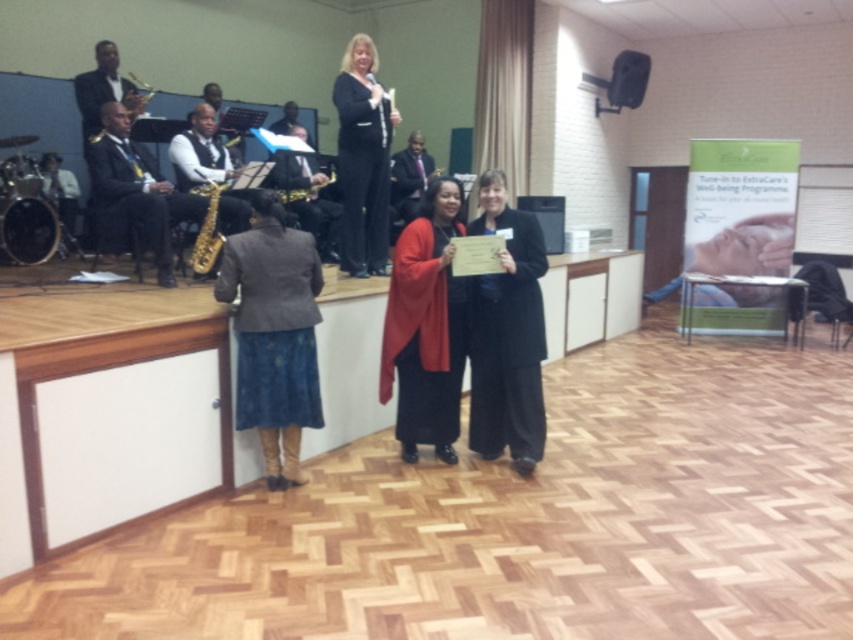
Between dark gray textured blazer at lower left and shiny black suit at left, which one is positioned lower?

dark gray textured blazer at lower left is lower down.

Which is above, dark gray textured blazer at lower left or shiny black suit at left?

shiny black suit at left is higher up.

Who is more distant from viewer, (316, 424) or (154, 236)?

The point (154, 236) is behind.

Identify the location of dark gray textured blazer at lower left. This screenshot has height=640, width=853. (274, 333).

Between point (344, 227) and point (140, 211), which one is positioned behind?

The point (344, 227) is behind.

Between point (347, 230) and point (113, 164), which one is positioned in front?

Point (113, 164) is more forward.

Between point (369, 160) and point (102, 113), which one is positioned behind?

The point (369, 160) is behind.

Locate an element on the screen. The width and height of the screenshot is (853, 640). black glossy suit at upper center is located at coordinates (363, 157).

Which of these two, dark gray textured blazer at lower left or black glossy suit at upper center, stands taller?

black glossy suit at upper center is taller.

Is dark gray textured blazer at lower left shorter than black glossy suit at upper center?

Indeed, dark gray textured blazer at lower left has a lesser height compared to black glossy suit at upper center.

Between point (236, 262) and point (370, 173), which one is positioned in front?

Positioned in front is point (236, 262).

Identify the location of dark gray textured blazer at lower left. This screenshot has height=640, width=853. (274, 333).